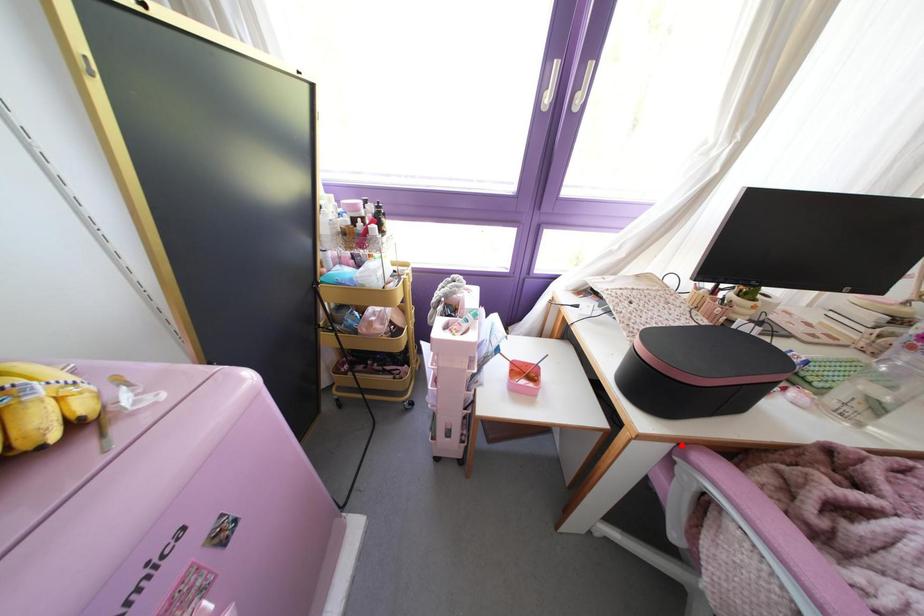
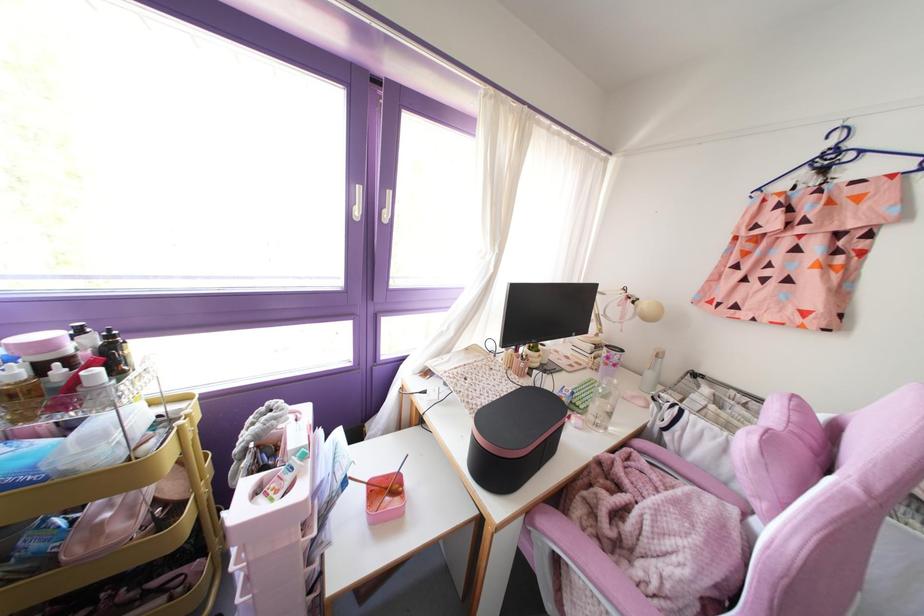
Find the pixel in the second image that matches the highlighted location in the first image.

(528, 513)